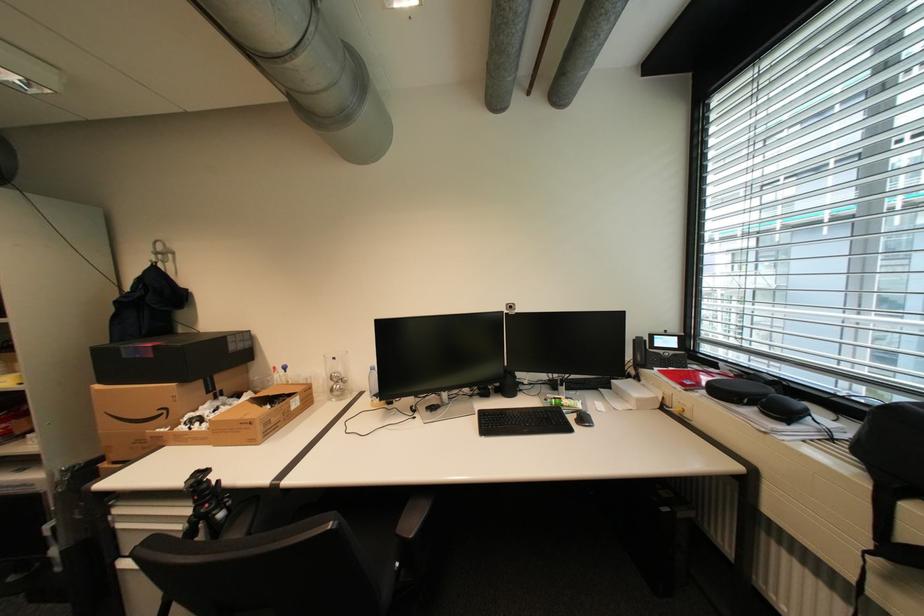
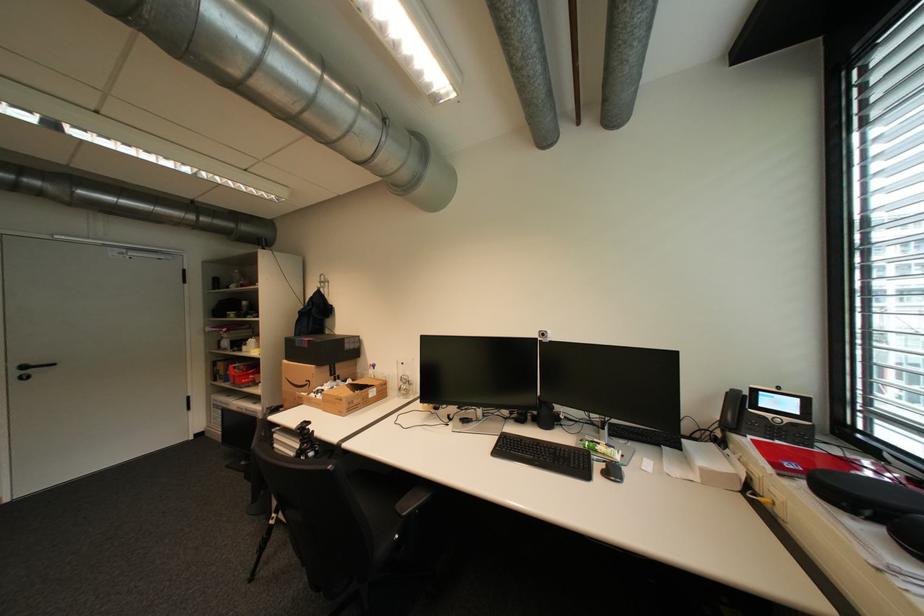
Where in the second image is the point corresponding to pixel 174 411 from the first image?

(317, 383)